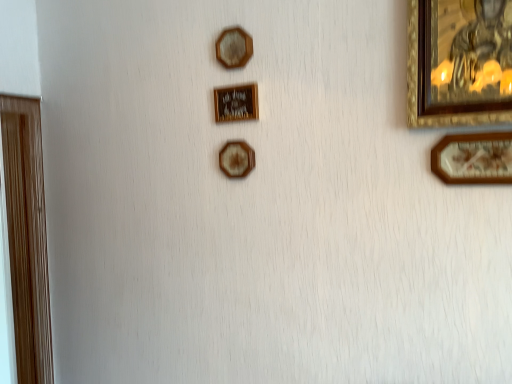
In order to face wooden door at left, the first picture frame in the back-to-front sequence, should I rotate leftwards or rightwards?

Turn left approximately 28.291 degrees to face it.

This screenshot has height=384, width=512. What do you see at coordinates (236, 103) in the screenshot? I see `gold metallic picture frame at center, the 4th picture frame from the left` at bounding box center [236, 103].

The image size is (512, 384). What do you see at coordinates (234, 47) in the screenshot?
I see `wooden hexagon at upper center, the 3th picture frame when ordered from front to back` at bounding box center [234, 47].

You are a GUI agent. You are given a task and a screenshot of the screen. Output one action in this format:
    pyautogui.click(x=<x>, y=<y>)
    Task: Click on the wooden hexagon at upper center, positioned as the second picture frame in left-to-right order
    
    Given the screenshot: What is the action you would take?
    coord(234,47)

You are a GUI agent. You are given a task and a screenshot of the screen. Output one action in this format:
    pyautogui.click(x=<x>, y=<y>)
    Task: Click on the gold-framed painting at upper right, arranged as the 2th picture frame when viewed from the right
    
    Given the screenshot: What is the action you would take?
    pyautogui.click(x=459, y=62)

Is wooden hexagon at center, the second picture frame positioned from the back, wider than gold-framed painting at upper right, arranged as the 2th picture frame when viewed from the right?

No.

Can you see wooden hexagon at center, marked as the fifth picture frame in a front-to-back arrangement, touching gold-framed painting at upper right, arranged as the 2th picture frame when viewed from the right?

No, wooden hexagon at center, marked as the fifth picture frame in a front-to-back arrangement, is not next to gold-framed painting at upper right, arranged as the 2th picture frame when viewed from the right.

The image size is (512, 384). Identify the location of the 2nd picture frame counting from the right side of the wooden hexagon at center, the 3th picture frame positioned from the left. (459, 62).

Does wooden hexagon at center, the fourth picture frame from the right, appear on the right side of gold-framed painting at upper right, which ranks as the 5th picture frame in back-to-front order?

Incorrect, wooden hexagon at center, the fourth picture frame from the right, is not on the right side of gold-framed painting at upper right, which ranks as the 5th picture frame in back-to-front order.

Is wooden door at left, which is the 1th picture frame in left-to-right order, inside or outside of gold metallic picture frame at center, the 4th picture frame from the left?

wooden door at left, which is the 1th picture frame in left-to-right order, cannot be found inside gold metallic picture frame at center, the 4th picture frame from the left.

Is the depth of wooden door at left, acting as the 6th picture frame starting from the right, less than that of gold metallic picture frame at center, acting as the 3th picture frame starting from the right?

No, wooden door at left, acting as the 6th picture frame starting from the right, is further to the viewer.

Is wooden door at left, which is the 1th picture frame in left-to-right order, positioned with its back to gold metallic picture frame at center, the 4th picture frame from the left?

wooden door at left, which is the 1th picture frame in left-to-right order, does not have its back to gold metallic picture frame at center, the 4th picture frame from the left.

From the image's perspective, is wooden door at left, which is the 1th picture frame in left-to-right order, positioned above or below gold metallic picture frame at center, marked as the fourth picture frame in a front-to-back arrangement?

From the image's perspective, wooden door at left, which is the 1th picture frame in left-to-right order, appears below gold metallic picture frame at center, marked as the fourth picture frame in a front-to-back arrangement.

From a real-world perspective, who is located lower, wooden hexagon at upper center, the 3th picture frame when ordered from front to back, or wooden hexagon at center, the second picture frame positioned from the back?

wooden hexagon at center, the second picture frame positioned from the back, is physically lower.

From the picture: Is wooden hexagon at upper center, positioned as the fifth picture frame in right-to-left order, situated inside wooden hexagon at center, marked as the fifth picture frame in a front-to-back arrangement, or outside?

wooden hexagon at upper center, positioned as the fifth picture frame in right-to-left order, is not inside wooden hexagon at center, marked as the fifth picture frame in a front-to-back arrangement, it's outside.

Which object is further away from the camera, wooden hexagon at upper center, positioned as the second picture frame in left-to-right order, or wooden hexagon at center, the second picture frame positioned from the back?

Positioned behind is wooden hexagon at center, the second picture frame positioned from the back.

Is gold-framed painting at upper right, the 2th picture frame when ordered from front to back, not close to wooden door at left, acting as the 6th picture frame starting from the right?

gold-framed painting at upper right, the 2th picture frame when ordered from front to back, is far away from wooden door at left, acting as the 6th picture frame starting from the right.

How many degrees apart are the facing directions of gold-framed painting at upper right, which ranks as the 5th picture frame in back-to-front order, and wooden door at left, acting as the 6th picture frame starting from the right?

gold-framed painting at upper right, which ranks as the 5th picture frame in back-to-front order, and wooden door at left, acting as the 6th picture frame starting from the right, are facing 90.4 degrees away from each other.

Which of these two, gold-framed painting at upper right, arranged as the fifth picture frame when viewed from the left, or wooden door at left, acting as the 6th picture frame starting from the right, is smaller?

Smaller between the two is gold-framed painting at upper right, arranged as the fifth picture frame when viewed from the left.

Can you tell me how much wooden hexagon at upper center, positioned as the second picture frame in left-to-right order, and wooden picture frame at right, which is the sixth picture frame in back-to-front order, differ in facing direction?

The facing directions of wooden hexagon at upper center, positioned as the second picture frame in left-to-right order, and wooden picture frame at right, which is the sixth picture frame in back-to-front order, are 0.642 degrees apart.

Could you tell me if wooden hexagon at upper center, the 4th picture frame when ordered from back to front, is facing wooden picture frame at right, which is the sixth picture frame in back-to-front order?

No, wooden hexagon at upper center, the 4th picture frame when ordered from back to front, is not turned towards wooden picture frame at right, which is the sixth picture frame in back-to-front order.

Considering the sizes of objects wooden hexagon at upper center, positioned as the second picture frame in left-to-right order, and wooden picture frame at right, marked as the 6th picture frame in a left-to-right arrangement, in the image provided, who is thinner, wooden hexagon at upper center, positioned as the second picture frame in left-to-right order, or wooden picture frame at right, marked as the 6th picture frame in a left-to-right arrangement,?

With smaller width is wooden picture frame at right, marked as the 6th picture frame in a left-to-right arrangement.

How much distance is there between wooden hexagon at upper center, positioned as the second picture frame in left-to-right order, and wooden picture frame at right, which is the first picture frame from right to left?

They are 35.74 inches apart.

Which of these two, gold metallic picture frame at center, acting as the 3th picture frame starting from the right, or wooden door at left, acting as the 6th picture frame starting from the right, is thinner?

Thinner between the two is gold metallic picture frame at center, acting as the 3th picture frame starting from the right.

Considering the relative positions of gold metallic picture frame at center, the 4th picture frame from the left, and wooden door at left, the first picture frame in the back-to-front sequence, in the image provided, is gold metallic picture frame at center, the 4th picture frame from the left, to the left of wooden door at left, the first picture frame in the back-to-front sequence, from the viewer's perspective?

No.

Which of these two, gold metallic picture frame at center, the 4th picture frame from the left, or wooden door at left, positioned as the sixth picture frame in front-to-back order, stands shorter?

gold metallic picture frame at center, the 4th picture frame from the left, is shorter.

Is gold metallic picture frame at center, acting as the 3th picture frame starting from the right, located outside wooden door at left, positioned as the sixth picture frame in front-to-back order?

Yes.

Is wooden hexagon at upper center, positioned as the fifth picture frame in right-to-left order, positioned before gold metallic picture frame at center, acting as the 3th picture frame starting from the right?

Yes, it is in front of gold metallic picture frame at center, acting as the 3th picture frame starting from the right.

Which of these two, wooden hexagon at upper center, positioned as the second picture frame in left-to-right order, or gold metallic picture frame at center, the 4th picture frame from the left, stands taller?

wooden hexagon at upper center, positioned as the second picture frame in left-to-right order.

In the scene shown: From the image's perspective, is wooden hexagon at upper center, positioned as the second picture frame in left-to-right order, located above gold metallic picture frame at center, marked as the fourth picture frame in a front-to-back arrangement?

Indeed, from the image's perspective, wooden hexagon at upper center, positioned as the second picture frame in left-to-right order, is shown above gold metallic picture frame at center, marked as the fourth picture frame in a front-to-back arrangement.

This screenshot has height=384, width=512. I want to click on picture frame that is the 2nd object located below the gold-framed painting at upper right, which ranks as the 5th picture frame in back-to-front order (from the image's perspective), so click(x=236, y=159).

Locate an element on the screen. picture frame that is the 3rd one when counting leftward from the gold metallic picture frame at center, acting as the third picture frame starting from the back is located at coordinates (27, 237).

Based on their spatial positions, is wooden hexagon at center, the second picture frame positioned from the back, or gold-framed painting at upper right, arranged as the fifth picture frame when viewed from the left, closer to wooden door at left, positioned as the sixth picture frame in front-to-back order?

wooden hexagon at center, the second picture frame positioned from the back, is positioned closer to the anchor wooden door at left, positioned as the sixth picture frame in front-to-back order.

Looking at the image, which one is located closer to wooden door at left, which is the 1th picture frame in left-to-right order, wooden picture frame at right, which is the first picture frame from right to left, or gold metallic picture frame at center, acting as the third picture frame starting from the back?

Based on the image, gold metallic picture frame at center, acting as the third picture frame starting from the back, appears to be nearer to wooden door at left, which is the 1th picture frame in left-to-right order.

When comparing their distances from wooden hexagon at center, the second picture frame positioned from the back, does wooden door at left, which is the 1th picture frame in left-to-right order, or wooden picture frame at right, the first picture frame in the front-to-back sequence, seem closer?

wooden picture frame at right, the first picture frame in the front-to-back sequence, is closer to wooden hexagon at center, the second picture frame positioned from the back.

Based on their spatial positions, is gold-framed painting at upper right, the 2th picture frame when ordered from front to back, or wooden door at left, the first picture frame in the back-to-front sequence, further from wooden hexagon at center, the 3th picture frame positioned from the left?

Among the two, wooden door at left, the first picture frame in the back-to-front sequence, is located further to wooden hexagon at center, the 3th picture frame positioned from the left.

When comparing their distances from gold metallic picture frame at center, acting as the third picture frame starting from the back, does wooden door at left, positioned as the sixth picture frame in front-to-back order, or wooden hexagon at center, marked as the fifth picture frame in a front-to-back arrangement, seem further?

wooden door at left, positioned as the sixth picture frame in front-to-back order, lies further to gold metallic picture frame at center, acting as the third picture frame starting from the back, than the other object.

Which object lies further to the anchor point wooden hexagon at center, marked as the fifth picture frame in a front-to-back arrangement, wooden picture frame at right, the first picture frame in the front-to-back sequence, or wooden door at left, acting as the 6th picture frame starting from the right?

wooden door at left, acting as the 6th picture frame starting from the right, lies further to wooden hexagon at center, marked as the fifth picture frame in a front-to-back arrangement, than the other object.

Looking at the image, which one is located closer to wooden door at left, positioned as the sixth picture frame in front-to-back order, gold metallic picture frame at center, acting as the 3th picture frame starting from the right, or wooden hexagon at center, the fourth picture frame from the right?

wooden hexagon at center, the fourth picture frame from the right, is positioned closer to the anchor wooden door at left, positioned as the sixth picture frame in front-to-back order.

Which object lies nearer to the anchor point wooden door at left, acting as the 6th picture frame starting from the right, gold-framed painting at upper right, arranged as the 2th picture frame when viewed from the right, or wooden hexagon at center, marked as the fifth picture frame in a front-to-back arrangement?

The object closer to wooden door at left, acting as the 6th picture frame starting from the right, is wooden hexagon at center, marked as the fifth picture frame in a front-to-back arrangement.

The image size is (512, 384). I want to click on picture frame located between gold metallic picture frame at center, acting as the third picture frame starting from the back, and wooden picture frame at right, the first picture frame in the front-to-back sequence, in the left-right direction, so click(x=459, y=62).

You are a GUI agent. You are given a task and a screenshot of the screen. Output one action in this format:
    pyautogui.click(x=<x>, y=<y>)
    Task: Click on the picture frame between wooden hexagon at center, the second picture frame positioned from the back, and gold-framed painting at upper right, arranged as the fifth picture frame when viewed from the left, in the horizontal direction
    This screenshot has height=384, width=512.
    Given the screenshot: What is the action you would take?
    pyautogui.click(x=236, y=103)

This screenshot has height=384, width=512. I want to click on picture frame located between wooden door at left, positioned as the sixth picture frame in front-to-back order, and wooden hexagon at center, the second picture frame positioned from the back, in the left-right direction, so click(x=234, y=47).